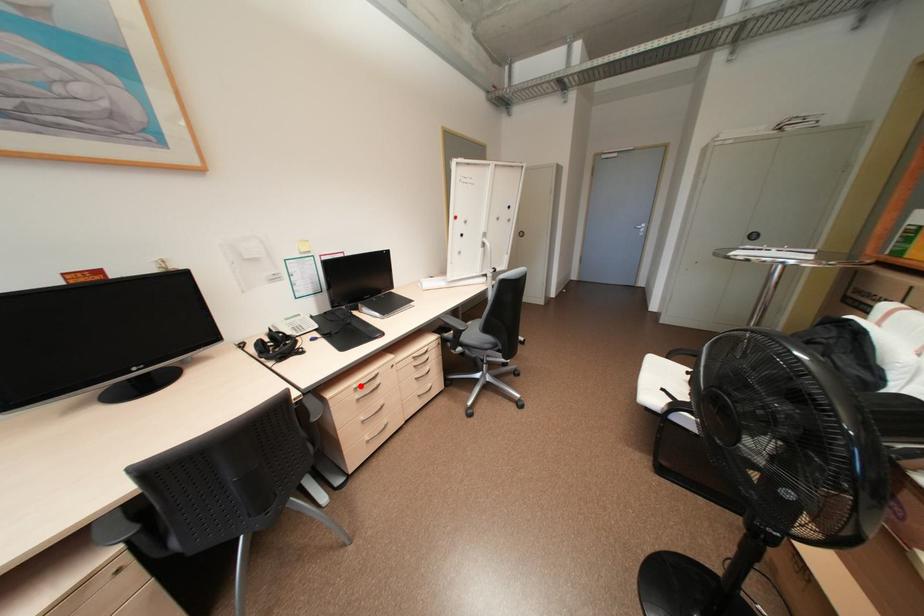
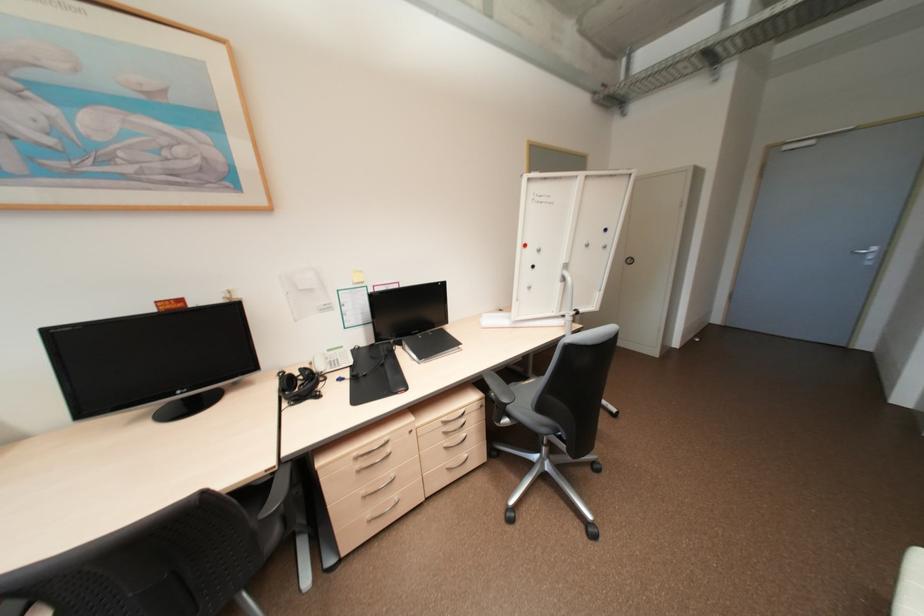
Locate, in the second image, the point that corresponds to the highlighted location in the first image.

(360, 454)